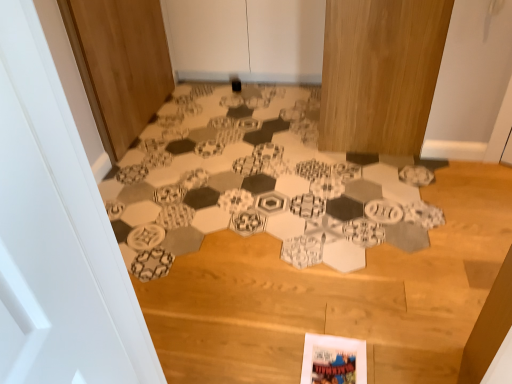
The width and height of the screenshot is (512, 384). Describe the element at coordinates (246, 39) in the screenshot. I see `white matte door at center, the 1th door from the right` at that location.

At what (x,y) coordinates should I click in order to perform the action: click on wooden door at left, the first door viewed from the left. Please return your answer as a coordinate pair (x, y). This screenshot has height=384, width=512. Looking at the image, I should click on (120, 64).

Identify the location of white matte door at center, the 1th door from the right. (246, 39).

How many degrees apart are the facing directions of white paper at center and white matte door at center, the 1th door from the right?

There is a 0.144-degree angle between the facing directions of white paper at center and white matte door at center, the 1th door from the right.

Is point (391, 185) more distant than point (256, 16)?

No, it is in front of (256, 16).

Is white paper at center facing towards white matte door at center, which is counted as the second door, starting from the left?

No.

Is there a large distance between white paper at center and white matte door at center, the 1th door from the right?

No, white paper at center is not far from white matte door at center, the 1th door from the right.

Consider the image. Is white matte door at center, which is counted as the second door, starting from the left, aimed at white paper at center?

Yes, white matte door at center, which is counted as the second door, starting from the left, faces towards white paper at center.

Find the location of a particular element. The height and width of the screenshot is (384, 512). print on the right side of white matte door at center, the 1th door from the right is located at coordinates (257, 183).

From the image's perspective, which is below, white matte door at center, which is counted as the second door, starting from the left, or white paper at center?

white paper at center appears lower in the image.

Considering the relative sizes of white matte door at center, which is counted as the second door, starting from the left, and white paper at center in the image provided, is white matte door at center, which is counted as the second door, starting from the left, shorter than white paper at center?

No, white matte door at center, which is counted as the second door, starting from the left, is not shorter than white paper at center.

Between white matte door at center, which is counted as the second door, starting from the left, and wooden door at left, marked as the 2th door in a right-to-left arrangement, which one has smaller size?

white matte door at center, which is counted as the second door, starting from the left, is smaller.

From a real-world perspective, between white matte door at center, which is counted as the second door, starting from the left, and wooden door at left, the first door viewed from the left, who is vertically lower?

white matte door at center, which is counted as the second door, starting from the left.

Which object is wider, white matte door at center, the 1th door from the right, or wooden door at left, the first door viewed from the left?

Wider between the two is white matte door at center, the 1th door from the right.

Which of these two, white paper at center or wooden door at left, the first door viewed from the left, is smaller?

With smaller size is wooden door at left, the first door viewed from the left.

Does white paper at center lie in front of wooden door at left, the first door viewed from the left?

Yes, it is in front of wooden door at left, the first door viewed from the left.

Is white paper at center taller than wooden door at left, marked as the 2th door in a right-to-left arrangement?

No.

From a real-world perspective, between white paper at center and wooden door at left, marked as the 2th door in a right-to-left arrangement, who is vertically lower?

In real-world perspective, white paper at center is lower.

Between wooden door at left, marked as the 2th door in a right-to-left arrangement, and white paper at center, which one has less height?

white paper at center.

Between wooden door at left, the first door viewed from the left, and white paper at center, which one has smaller size?

With smaller size is wooden door at left, the first door viewed from the left.

Where is `the 1st door behind the white paper at center`? The image size is (512, 384). the 1st door behind the white paper at center is located at coordinates (120, 64).

Is wooden door at left, marked as the 2th door in a right-to-left arrangement, positioned beyond the bounds of white paper at center?

Yes, wooden door at left, marked as the 2th door in a right-to-left arrangement, is not within white paper at center.

Measure the distance from wooden door at left, marked as the 2th door in a right-to-left arrangement, to white matte door at center, the 1th door from the right.

The distance of wooden door at left, marked as the 2th door in a right-to-left arrangement, from white matte door at center, the 1th door from the right, is 26.89 inches.

Would you say wooden door at left, marked as the 2th door in a right-to-left arrangement, is outside white matte door at center, which is counted as the second door, starting from the left?

Yes, wooden door at left, marked as the 2th door in a right-to-left arrangement, is outside of white matte door at center, which is counted as the second door, starting from the left.

The width and height of the screenshot is (512, 384). Find the location of `door on the left of white matte door at center, which is counted as the second door, starting from the left`. door on the left of white matte door at center, which is counted as the second door, starting from the left is located at coordinates (120, 64).

Is wooden door at left, the first door viewed from the left, shorter than white matte door at center, which is counted as the second door, starting from the left?

Incorrect, the height of wooden door at left, the first door viewed from the left, does not fall short of that of white matte door at center, which is counted as the second door, starting from the left.

From a real-world perspective, count 1st doors upward from the white paper at center and point to it. Please provide its 2D coordinates.

[(246, 39)]

At what (x,y) coordinates should I click in order to perform the action: click on door that is the 2nd object located above the white paper at center (from the image's perspective). Please return your answer as a coordinate pair (x, y). This screenshot has width=512, height=384. Looking at the image, I should click on (246, 39).

Considering their positions, is wooden door at left, marked as the 2th door in a right-to-left arrangement, positioned closer to white paper at center than white matte door at center, the 1th door from the right?

Based on the image, wooden door at left, marked as the 2th door in a right-to-left arrangement, appears to be nearer to white paper at center.

Considering their positions, is white matte door at center, the 1th door from the right, positioned further to white paper at center than wooden door at left, marked as the 2th door in a right-to-left arrangement?

white matte door at center, the 1th door from the right, is positioned further to the anchor white paper at center.

Which object lies further to the anchor point white matte door at center, which is counted as the second door, starting from the left, white paper at center or wooden door at left, marked as the 2th door in a right-to-left arrangement?

The object further to white matte door at center, which is counted as the second door, starting from the left, is white paper at center.

When comparing their distances from wooden door at left, marked as the 2th door in a right-to-left arrangement, does white matte door at center, which is counted as the second door, starting from the left, or white paper at center seem closer?

white paper at center.

Which object lies nearer to the anchor point wooden door at left, marked as the 2th door in a right-to-left arrangement, white paper at center or white matte door at center, the 1th door from the right?

Based on the image, white paper at center appears to be nearer to wooden door at left, marked as the 2th door in a right-to-left arrangement.

Which object lies nearer to the anchor point white matte door at center, which is counted as the second door, starting from the left, wooden door at left, the first door viewed from the left, or white paper at center?

wooden door at left, the first door viewed from the left, is closer to white matte door at center, which is counted as the second door, starting from the left.

This screenshot has width=512, height=384. I want to click on door between white paper at center and white matte door at center, the 1th door from the right, from front to back, so click(120, 64).